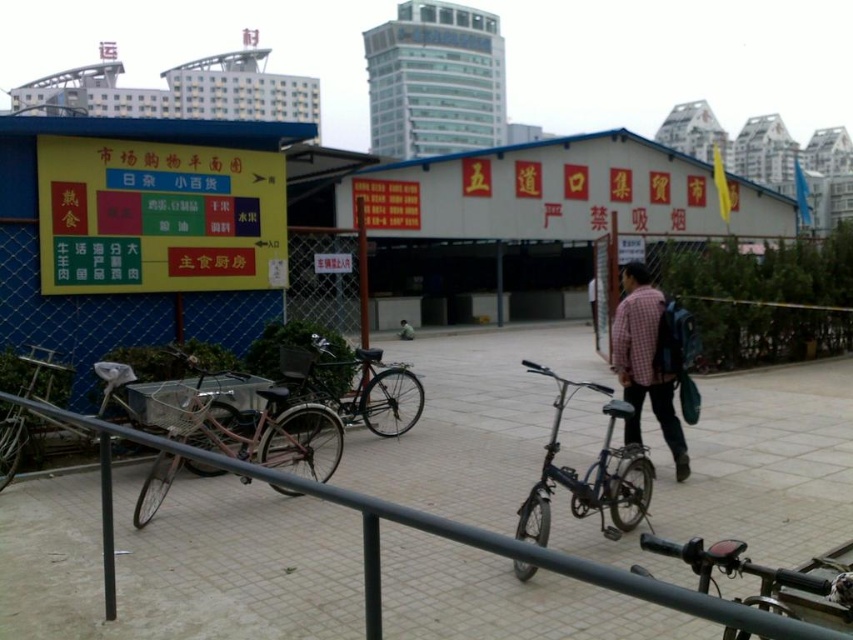
Is blue metallic bicycle at center above plaid shirt at center?

No, blue metallic bicycle at center is not above plaid shirt at center.

Between blue metallic bicycle at center and plaid shirt at center, which one is positioned lower?

Positioned lower is blue metallic bicycle at center.

Measure the distance between point [544,365] and camera.

Point [544,365] is 13.71 meters away from camera.

Find the location of a particular element. Image resolution: width=853 pixels, height=640 pixels. blue metallic bicycle at center is located at coordinates (587, 474).

The height and width of the screenshot is (640, 853). Describe the element at coordinates (587, 474) in the screenshot. I see `blue metallic bicycle at center` at that location.

Measure the distance between blue metallic bicycle at center and camera.

blue metallic bicycle at center is 13.65 feet away from camera.

Find the location of `blue metallic bicycle at center`. blue metallic bicycle at center is located at coordinates (587, 474).

From the picture: Can you confirm if gray concrete pavement at center is smaller than shiny black bicycle at center?

No.

Does gray concrete pavement at center have a greater height compared to shiny black bicycle at center?

No.

Between point (402, 605) and point (323, 355), which one is positioned behind?

Point (323, 355)

Locate an element on the screen. Image resolution: width=853 pixels, height=640 pixels. gray concrete pavement at center is located at coordinates (178, 563).